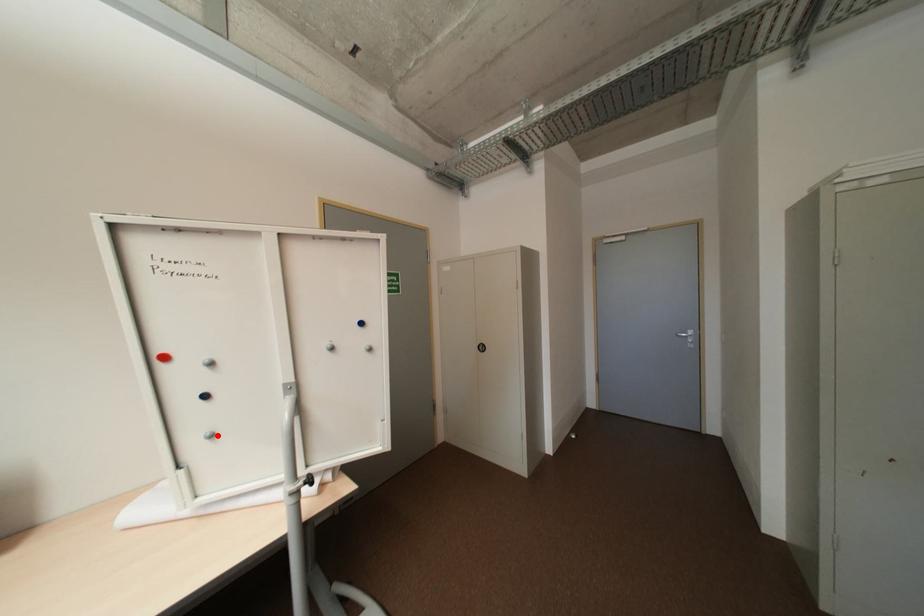
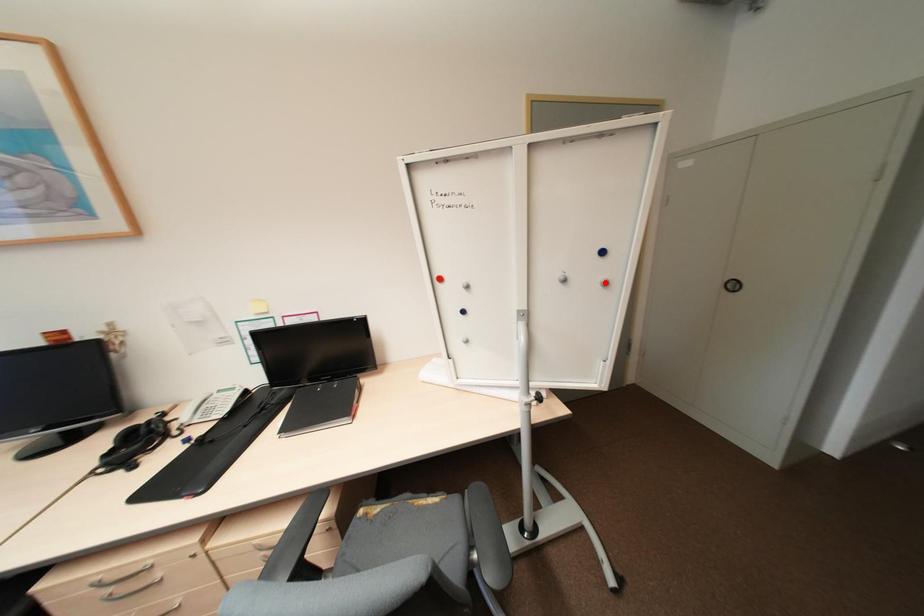
I am providing you with two images of the same scene from different viewpoints. A red point is marked on the first image and another point is marked on the second image. Do the highlighted points in image1 and image2 indicate the same real-world spot?

No